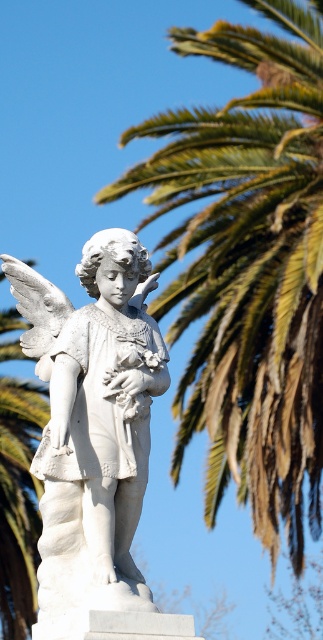
You are an art student standing in front of the white marble statue at center and the green leafy palm at upper right. Which object is closer to you?

The green leafy palm at upper right is closer to you because it is positioned further to the viewer than the white marble statue at center.

You are an art student analyzing the composition of this statue scene. Considering the placement of the green leafy palm at upper right and the white marble statue at center, which object is positioned higher in the image?

The green leafy palm at upper right is positioned higher than the white marble statue at center in the image.

You are standing in front of the statue and want to determine the position of two points marked on it. The first point is at coordinates point (242, 378) and the second is at point (70, 392). Which point is closer to you?

Point (242, 378) is further to the viewer than point (70, 392), so the point closer to you is point (70, 392).